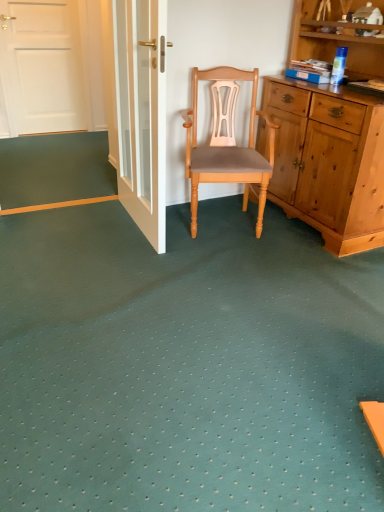
You are a GUI agent. You are given a task and a screenshot of the screen. Output one action in this format:
    pyautogui.click(x=<x>, y=<y>)
    Task: Click on the vacant area in front of light brown wood chair at center
    
    Given the screenshot: What is the action you would take?
    pyautogui.click(x=249, y=274)